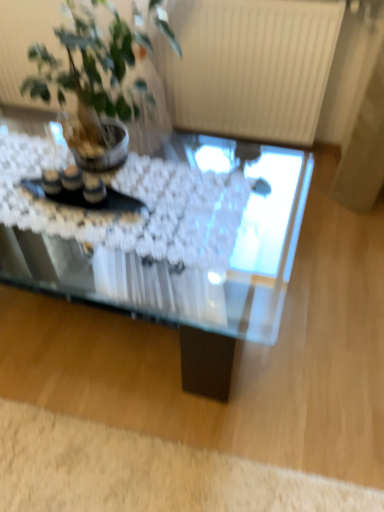
What is the approximate width of transparent glass coffee table at center?

The width of transparent glass coffee table at center is 27.86 inches.

Describe the element at coordinates (146, 472) in the screenshot. The width and height of the screenshot is (384, 512). I see `white fluffy rug at lower left` at that location.

Identify the location of white fluffy rug at lower left. (146, 472).

At what (x,y) coordinates should I click in order to perform the action: click on green leafy plant at upper left. Please return your answer as a coordinate pair (x, y). Looking at the image, I should click on (92, 70).

Where is `plain behind the transparent glass coffee table at center`? plain behind the transparent glass coffee table at center is located at coordinates (146, 472).

Are white fluffy rug at lower left and transparent glass coffee table at center far apart?

No.

Considering the sizes of objects white fluffy rug at lower left and transparent glass coffee table at center in the image provided, who is bigger, white fluffy rug at lower left or transparent glass coffee table at center?

With larger size is transparent glass coffee table at center.

Can you confirm if white fluffy rug at lower left is positioned to the left of transparent glass coffee table at center?

In fact, white fluffy rug at lower left is to the right of transparent glass coffee table at center.

Considering the sizes of white fluffy rug at lower left and green leafy plant at upper left in the image, is white fluffy rug at lower left wider or thinner than green leafy plant at upper left?

Considering their sizes, white fluffy rug at lower left looks slimmer than green leafy plant at upper left.

Is white fluffy rug at lower left not within green leafy plant at upper left?

Yes.

Considering the positions of points (245, 498) and (120, 100), is point (245, 498) farther from camera compared to point (120, 100)?

No.

Is transparent glass coffee table at center not within green leafy plant at upper left?

Yes, transparent glass coffee table at center is not within green leafy plant at upper left.

From the image's perspective, does transparent glass coffee table at center appear lower than green leafy plant at upper left?

Yes, from the image's perspective, transparent glass coffee table at center is below green leafy plant at upper left.

Which point is more forward, [301,200] or [131,116]?

The point [131,116] is in front.

Can you confirm if transparent glass coffee table at center is shorter than green leafy plant at upper left?

Incorrect, the height of transparent glass coffee table at center does not fall short of that of green leafy plant at upper left.

From the image's perspective, which is below, transparent glass coffee table at center or white fluffy rug at lower left?

From the image's view, white fluffy rug at lower left is below.

Is transparent glass coffee table at center at the right side of white fluffy rug at lower left?

In fact, transparent glass coffee table at center is to the left of white fluffy rug at lower left.

How far apart are transparent glass coffee table at center and white fluffy rug at lower left?

14.89 inches.

Is point (83, 282) positioned before point (368, 503)?

No, it is behind (368, 503).

Can you confirm if green leafy plant at upper left is positioned to the left of white fluffy rug at lower left?

Correct, you'll find green leafy plant at upper left to the left of white fluffy rug at lower left.

Considering the sizes of objects green leafy plant at upper left and white fluffy rug at lower left in the image provided, who is wider, green leafy plant at upper left or white fluffy rug at lower left?

green leafy plant at upper left is wider.

Are green leafy plant at upper left and white fluffy rug at lower left far apart?

green leafy plant at upper left is far away from white fluffy rug at lower left.

Is green leafy plant at upper left oriented away from white fluffy rug at lower left?

green leafy plant at upper left does not have its back to white fluffy rug at lower left.

Considering the positions of objects green leafy plant at upper left and transparent glass coffee table at center in the image provided, who is behind, green leafy plant at upper left or transparent glass coffee table at center?

transparent glass coffee table at center is further away from the camera.

Is point (104, 99) farther from viewer compared to point (229, 381)?

No, (104, 99) is in front of (229, 381).

Is green leafy plant at upper left located outside transparent glass coffee table at center?

Yes, green leafy plant at upper left is outside of transparent glass coffee table at center.

Is green leafy plant at upper left aimed at transparent glass coffee table at center?

No, green leafy plant at upper left does not turn towards transparent glass coffee table at center.

What are the coordinates of `coffee table that appears on the left of white fluffy rug at lower left` in the screenshot? It's located at (186, 270).

Where is `houseplant lying in front of the white fluffy rug at lower left`? The width and height of the screenshot is (384, 512). houseplant lying in front of the white fluffy rug at lower left is located at coordinates coord(92,70).

When comparing their distances from transparent glass coffee table at center, does white fluffy rug at lower left or green leafy plant at upper left seem further?

Among the two, green leafy plant at upper left is located further to transparent glass coffee table at center.

When comparing their distances from green leafy plant at upper left, does white fluffy rug at lower left or transparent glass coffee table at center seem further?

white fluffy rug at lower left.

When comparing their distances from transparent glass coffee table at center, does green leafy plant at upper left or white fluffy rug at lower left seem further?

green leafy plant at upper left is further to transparent glass coffee table at center.

Which object lies further to the anchor point white fluffy rug at lower left, green leafy plant at upper left or transparent glass coffee table at center?

Based on the image, green leafy plant at upper left appears to be further to white fluffy rug at lower left.

When comparing their distances from green leafy plant at upper left, does transparent glass coffee table at center or white fluffy rug at lower left seem further?

Based on the image, white fluffy rug at lower left appears to be further to green leafy plant at upper left.

From the image, which object appears to be farther from white fluffy rug at lower left, transparent glass coffee table at center or green leafy plant at upper left?

green leafy plant at upper left.

The height and width of the screenshot is (512, 384). In order to click on coffee table between green leafy plant at upper left and white fluffy rug at lower left in the up-down direction in this screenshot , I will do `click(186, 270)`.